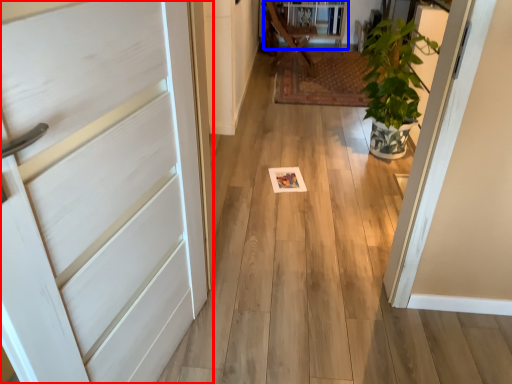
Question: Among these objects, which one is farthest to the camera, door (highlighted by a red box) or bookshelf (highlighted by a blue box)?

Choices:
 (A) door
 (B) bookshelf

Answer: (B)